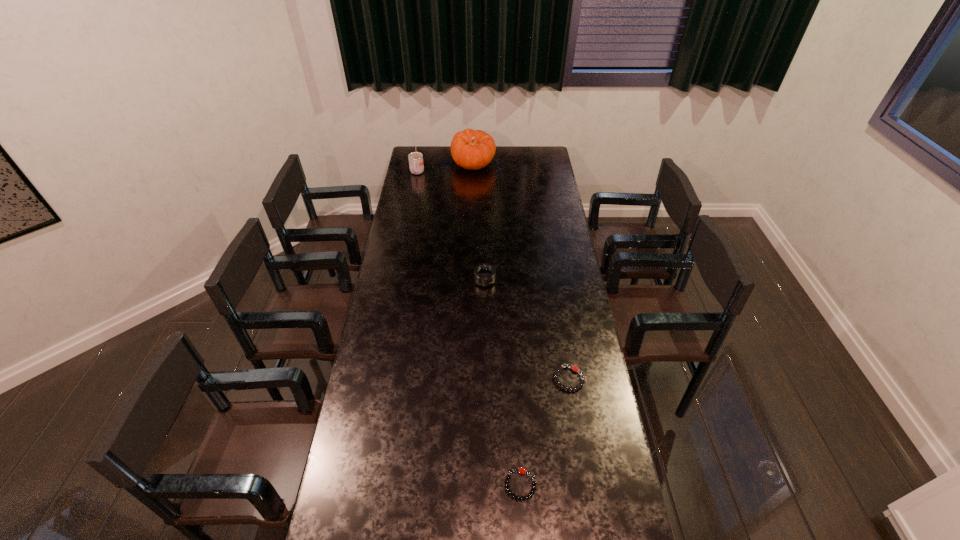
The height and width of the screenshot is (540, 960). I want to click on free space at the far right corner, so click(549, 164).

At what (x,y) coordinates should I click in order to perform the action: click on free space between the fourth shortest object and the tallest object. Please return your answer as a coordinate pair (x, y). Looking at the image, I should click on (445, 168).

Identify the location of unoccupied area between the left bracelet and the farther bracelet. (545, 432).

The width and height of the screenshot is (960, 540). What are the coordinates of `vacant space in between the telephoto lens and the pumpkin` in the screenshot? It's located at (479, 222).

This screenshot has width=960, height=540. Find the location of `free spot between the shorter bracelet and the second tallest object`. free spot between the shorter bracelet and the second tallest object is located at coordinates (468, 329).

Where is `free space that is in between the fourth shortest object and the nearer bracelet`? The image size is (960, 540). free space that is in between the fourth shortest object and the nearer bracelet is located at coordinates click(x=468, y=329).

Image resolution: width=960 pixels, height=540 pixels. Identify the location of free spot between the left bracelet and the rightmost object. (545, 432).

Find the location of a particular element. The image size is (960, 540). the closest object to the rightmost object is located at coordinates (521, 470).

At what (x,y) coordinates should I click in order to perform the action: click on the closest object to the pumpkin. Please return your answer as a coordinate pair (x, y). This screenshot has height=540, width=960. Looking at the image, I should click on (416, 166).

Where is `free space that satisfies the following two spatial constraints: 1. on the side with the handle of the fourth shortest object; 2. on the left side of the nearer bracelet`? The width and height of the screenshot is (960, 540). free space that satisfies the following two spatial constraints: 1. on the side with the handle of the fourth shortest object; 2. on the left side of the nearer bracelet is located at coordinates (359, 485).